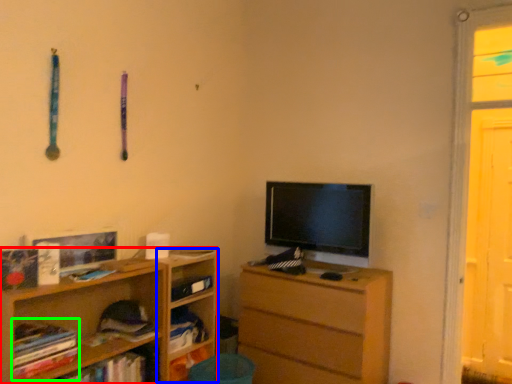
Question: Which object is positioned closest to shelf (highlighted by a red box)? Select from shelf (highlighted by a blue box) and book (highlighted by a green box).

Choices:
 (A) shelf
 (B) book

Answer: (A)